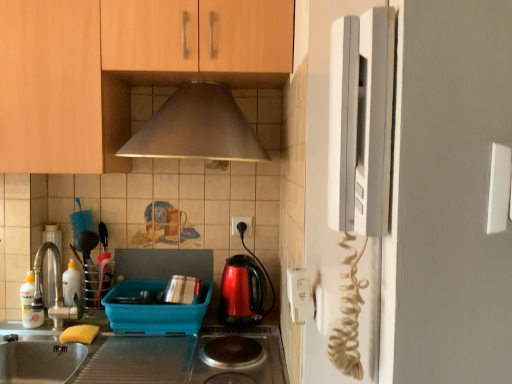
At what (x,y) coordinates should I click in order to perform the action: click on free space in front of shiny plastic kettle at center. Please return your answer as a coordinate pair (x, y). The image size is (512, 384). Looking at the image, I should click on (233, 338).